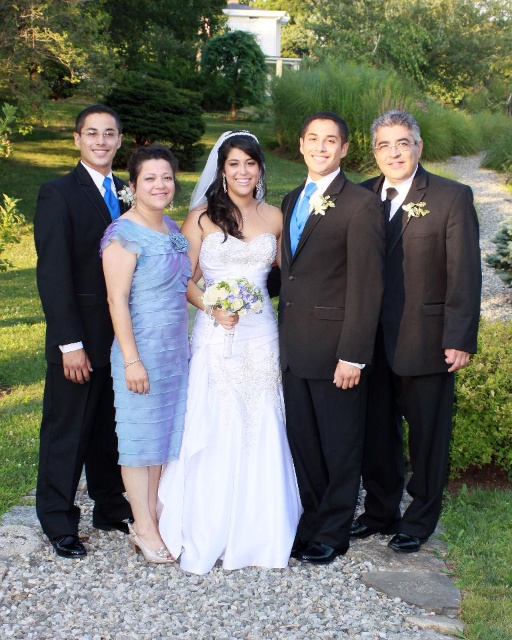
What do you see at coordinates (416, 332) in the screenshot? The height and width of the screenshot is (640, 512). I see `black satin suit at right` at bounding box center [416, 332].

The image size is (512, 640). What do you see at coordinates (416, 332) in the screenshot?
I see `black satin suit at right` at bounding box center [416, 332].

Identify the location of black satin suit at right. Image resolution: width=512 pixels, height=640 pixels. (416, 332).

Is shiny black suit at left in front of light blue chiffon dress at center?

No, shiny black suit at left is further to the viewer.

Which is below, shiny black suit at left or light blue chiffon dress at center?

light blue chiffon dress at center is below.

In order to click on shiny black suit at left in this screenshot , I will do `click(77, 339)`.

Between white satin dress at center and light blue chiffon dress at center, which one has more height?

light blue chiffon dress at center

From the picture: Does white satin dress at center have a lesser width compared to light blue chiffon dress at center?

No, white satin dress at center is not thinner than light blue chiffon dress at center.

Is point (234, 346) more distant than point (121, 451)?

Yes.

Identify the location of white satin dress at center. (231, 432).